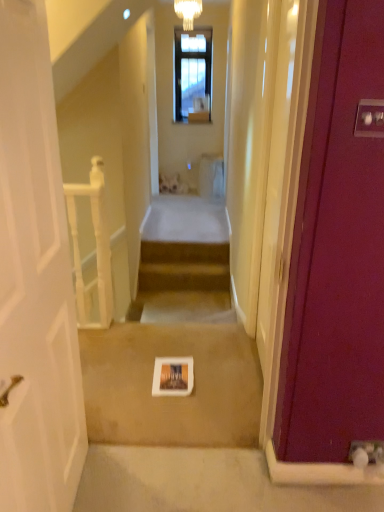
Question: Are white wooden balustrade at left and white glass chandelier at upper center making contact?

Choices:
 (A) yes
 (B) no

Answer: (B)

Question: Is white wooden balustrade at left closer to the viewer compared to white glass chandelier at upper center?

Choices:
 (A) yes
 (B) no

Answer: (A)

Question: Can you confirm if white wooden balustrade at left is bigger than white glass chandelier at upper center?

Choices:
 (A) yes
 (B) no

Answer: (A)

Question: Is white wooden balustrade at left not within white glass chandelier at upper center?

Choices:
 (A) yes
 (B) no

Answer: (A)

Question: Are white wooden balustrade at left and white glass chandelier at upper center located far from each other?

Choices:
 (A) yes
 (B) no

Answer: (A)

Question: From the image's perspective, does white wooden balustrade at left appear higher than white glass chandelier at upper center?

Choices:
 (A) no
 (B) yes

Answer: (A)

Question: From a real-world perspective, is white matte book at center beneath white glass chandelier at upper center?

Choices:
 (A) no
 (B) yes

Answer: (B)

Question: Is the position of white matte book at center more distant than that of white glass chandelier at upper center?

Choices:
 (A) yes
 (B) no

Answer: (B)

Question: Does white matte book at center have a lesser width compared to white glass chandelier at upper center?

Choices:
 (A) yes
 (B) no

Answer: (B)

Question: Considering the relative positions of white matte book at center and white glass chandelier at upper center in the image provided, is white matte book at center to the left of white glass chandelier at upper center from the viewer's perspective?

Choices:
 (A) yes
 (B) no

Answer: (A)

Question: From the image's perspective, does white matte book at center appear higher than white glass chandelier at upper center?

Choices:
 (A) yes
 (B) no

Answer: (B)

Question: Does white matte book at center have a smaller size compared to white glass chandelier at upper center?

Choices:
 (A) no
 (B) yes

Answer: (A)

Question: Is white matte book at center placed right next to white wooden balustrade at left?

Choices:
 (A) no
 (B) yes

Answer: (A)